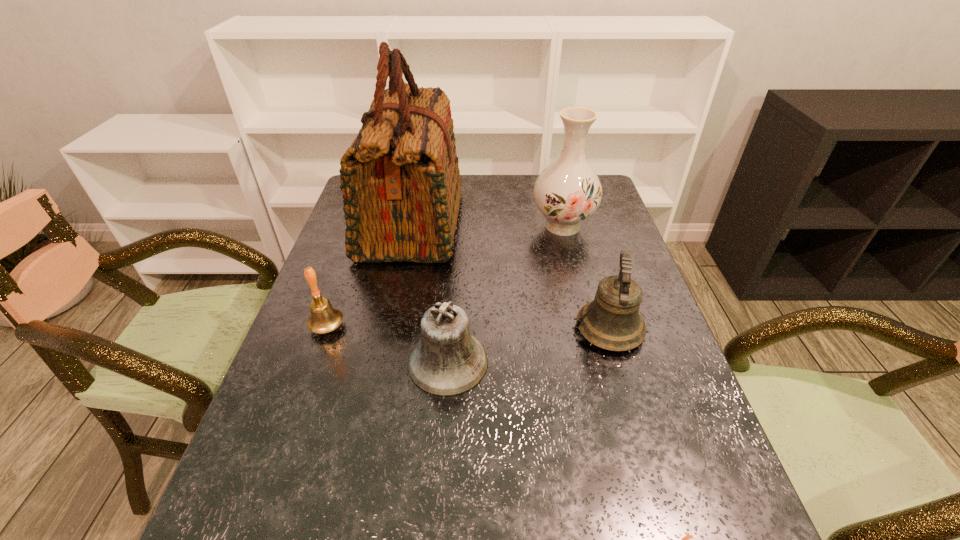
Locate an element on the screen. shopping bag present at the far edge is located at coordinates (400, 179).

Where is `vase positioned at the far edge`? Image resolution: width=960 pixels, height=540 pixels. vase positioned at the far edge is located at coordinates (567, 192).

You are a GUI agent. You are given a task and a screenshot of the screen. Output one action in this format:
    pyautogui.click(x=<x>, y=<y>)
    Task: Click on the shopping bag that is at the left edge
    Image resolution: width=960 pixels, height=540 pixels.
    Given the screenshot: What is the action you would take?
    pyautogui.click(x=400, y=179)

Find the location of `bell present at the left edge`. bell present at the left edge is located at coordinates (324, 318).

In order to click on vase that is at the right edge in this screenshot , I will do tap(567, 192).

Where is `bell that is at the right edge`? The width and height of the screenshot is (960, 540). bell that is at the right edge is located at coordinates (611, 321).

Find the location of a particular element. The image size is (960, 540). object located at the far left corner is located at coordinates (400, 179).

This screenshot has height=540, width=960. Find the location of `object at the far right corner`. object at the far right corner is located at coordinates (567, 192).

You are a GUI agent. You are given a task and a screenshot of the screen. Output one action in this format:
    pyautogui.click(x=<x>, y=<y>)
    Task: Click on the free space at the far edge of the desktop
    Image resolution: width=960 pixels, height=540 pixels.
    Given the screenshot: What is the action you would take?
    pyautogui.click(x=529, y=175)

In order to click on vacant space at the left edge of the desktop in this screenshot , I will do `click(331, 420)`.